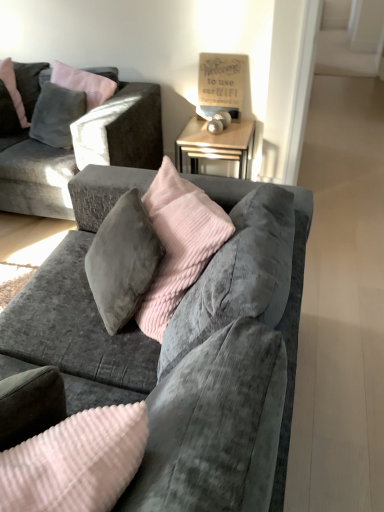
Question: Is matte gray pillow at upper left bigger or smaller than velvet gray couch at center, placed as the first studio couch when sorted from bottom to top?

Choices:
 (A) small
 (B) big

Answer: (A)

Question: In terms of height, does matte gray pillow at upper left look taller or shorter compared to velvet gray couch at center, the 2th studio couch from the top?

Choices:
 (A) tall
 (B) short

Answer: (B)

Question: Based on their relative distances, which object is nearer to the matte gray pillow at upper left?

Choices:
 (A) velvet gray couch at center, placed as the first studio couch when sorted from bottom to top
 (B) velvet gray couch at upper left, which ranks as the second studio couch in front-to-back order

Answer: (B)

Question: Which object is positioned farthest from the velvet gray couch at center, the 2th studio couch from the top?

Choices:
 (A) matte gray pillow at upper left
 (B) velvet gray couch at upper left, positioned as the 2th studio couch in bottom-to-top order

Answer: (A)